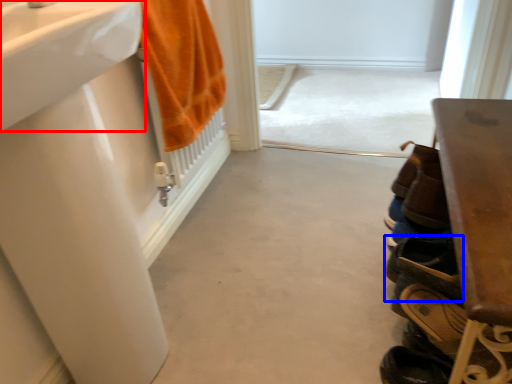
Question: Among these objects, which one is nearest to the camera, sink (highlighted by a red box) or footwear (highlighted by a blue box)?

Choices:
 (A) sink
 (B) footwear

Answer: (A)